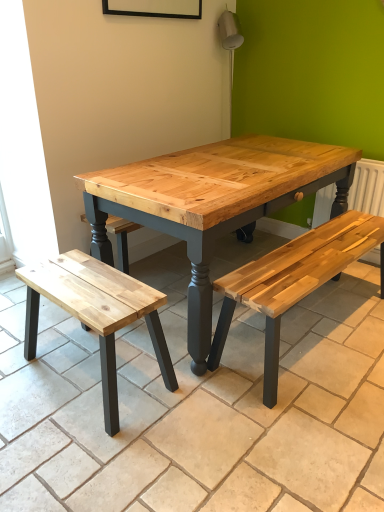
What are the coordinates of `vacant region to the left of natural wood bench at lower left` in the screenshot? It's located at (26, 370).